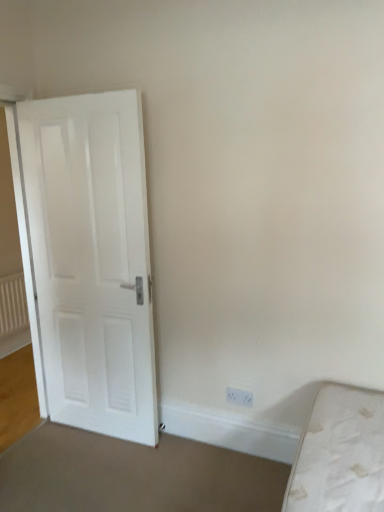
Question: In terms of size, does white plastic electric outlet at lower right appear bigger or smaller than white matte door at left?

Choices:
 (A) big
 (B) small

Answer: (B)

Question: From the image's perspective, relative to white matte door at left, is white plastic electric outlet at lower right above or below?

Choices:
 (A) below
 (B) above

Answer: (A)

Question: Which object is positioned closest to the white matte door at left?

Choices:
 (A) white plastic electric outlet at lower right
 (B) white textured radiator at left

Answer: (A)

Question: Which of these objects is positioned closest to the white matte door at left?

Choices:
 (A) white plastic electric outlet at lower right
 (B) white textured radiator at left

Answer: (A)